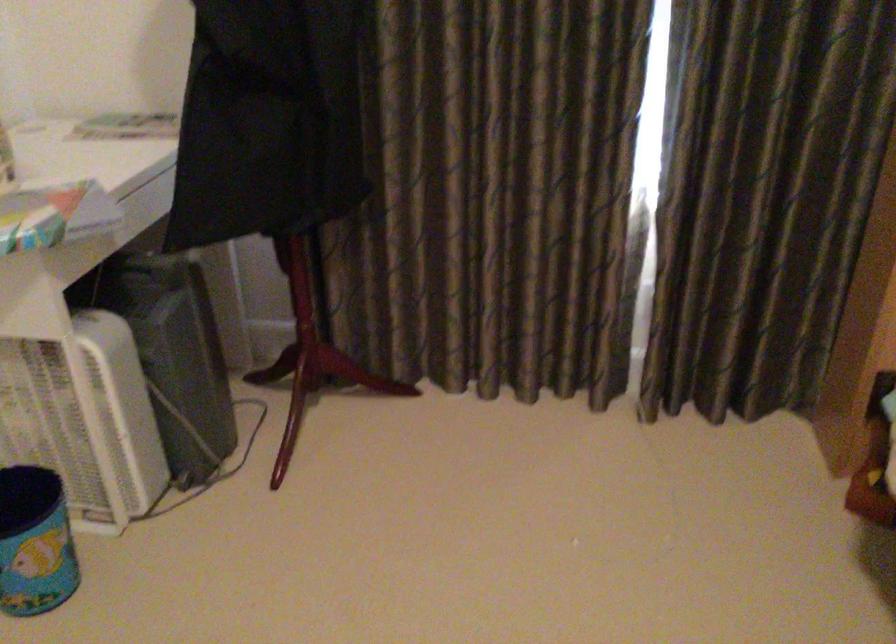
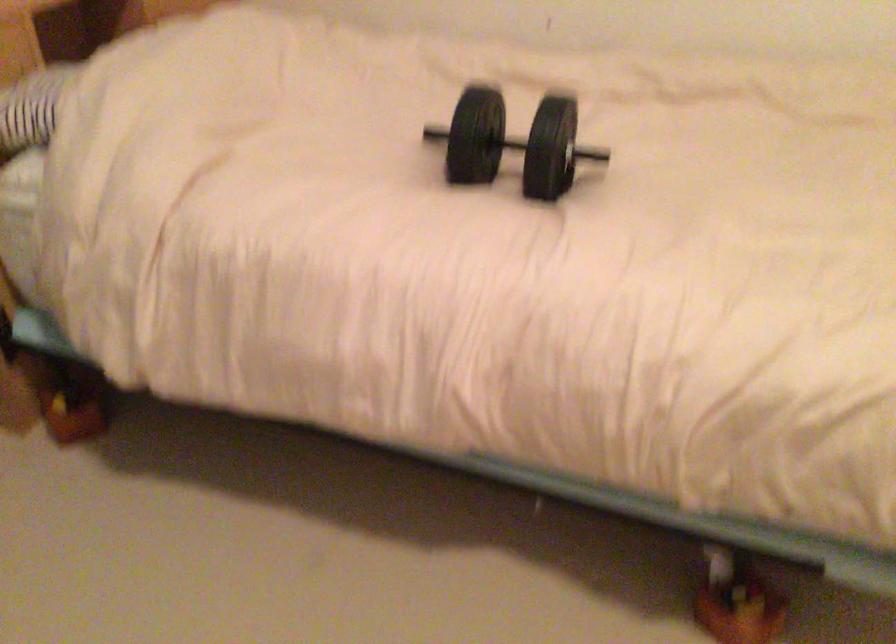
The first image is from the beginning of the video and the second image is from the end. How did the camera likely rotate when shooting the video?

The camera's rotation is toward right-down.